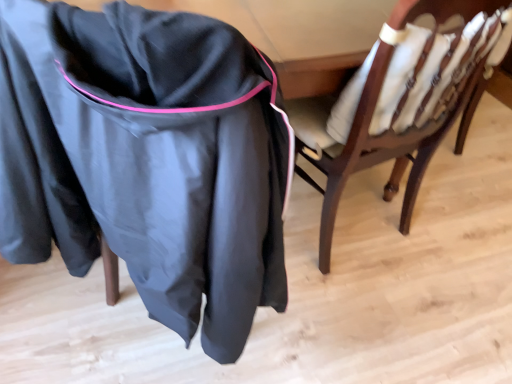
Question: From a real-world perspective, is wooden chair with white cushions at center located beneath matte black jacket at left?

Choices:
 (A) yes
 (B) no

Answer: (A)

Question: Is wooden chair with white cushions at center closer to camera compared to matte black jacket at left?

Choices:
 (A) no
 (B) yes

Answer: (A)

Question: Is wooden chair with white cushions at center at the right side of matte black jacket at left?

Choices:
 (A) no
 (B) yes

Answer: (B)

Question: Is the depth of wooden chair with white cushions at center greater than that of matte black jacket at left?

Choices:
 (A) yes
 (B) no

Answer: (A)

Question: Would you say wooden chair with white cushions at center is outside matte black jacket at left?

Choices:
 (A) yes
 (B) no

Answer: (A)

Question: Are wooden chair with white cushions at center and matte black jacket at left making contact?

Choices:
 (A) no
 (B) yes

Answer: (A)

Question: From a real-world perspective, is matte black jacket at left positioned under wooden chair with white cushions at center based on gravity?

Choices:
 (A) yes
 (B) no

Answer: (B)

Question: Is matte black jacket at left surrounding wooden chair with white cushions at center?

Choices:
 (A) yes
 (B) no

Answer: (B)

Question: Can you confirm if matte black jacket at left is smaller than wooden chair with white cushions at center?

Choices:
 (A) yes
 (B) no

Answer: (B)

Question: Does matte black jacket at left have a lesser width compared to wooden chair with white cushions at center?

Choices:
 (A) yes
 (B) no

Answer: (B)

Question: Is matte black jacket at left positioned beyond the bounds of wooden chair with white cushions at center?

Choices:
 (A) no
 (B) yes

Answer: (B)

Question: Is wooden chair with white cushions at center at the back of matte black jacket at left?

Choices:
 (A) yes
 (B) no

Answer: (B)

Question: From a real-world perspective, is matte black jacket at left physically located above or below wooden chair with white cushions at center?

Choices:
 (A) above
 (B) below

Answer: (A)